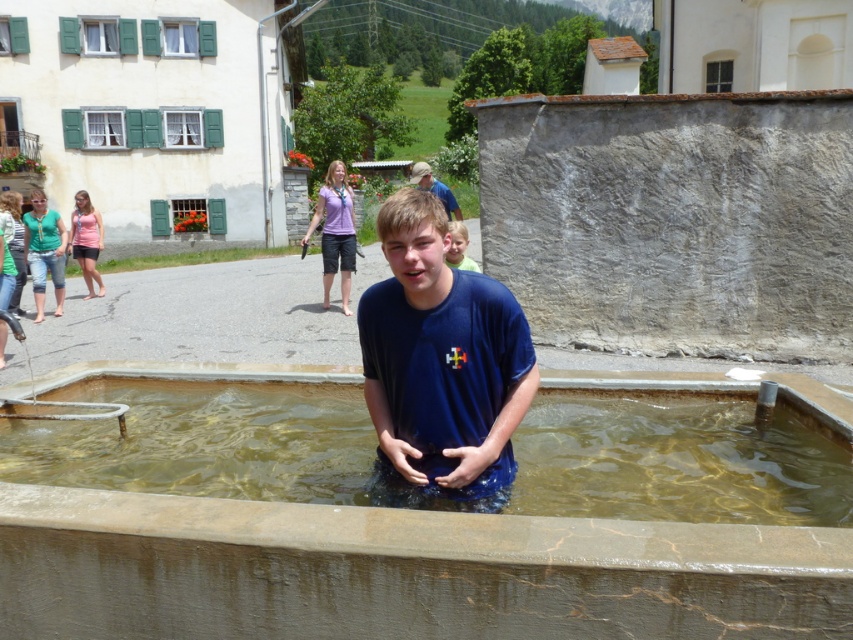
Question: Is blue matte shirt at center in front of light brown hair at upper right?

Choices:
 (A) no
 (B) yes

Answer: (B)

Question: Can you confirm if clear concrete water at center is positioned above blue matte shirt at center?

Choices:
 (A) yes
 (B) no

Answer: (B)

Question: Does clear concrete water at center appear over blue matte shirt at center?

Choices:
 (A) no
 (B) yes

Answer: (A)

Question: Which object is closer to the camera taking this photo?

Choices:
 (A) clear concrete water at center
 (B) light brown hair at upper right

Answer: (A)

Question: Which of these objects is positioned closest to the clear concrete water at center?

Choices:
 (A) light brown hair at upper right
 (B) blue matte shirt at center

Answer: (B)

Question: Which point appears closest to the camera in this image?

Choices:
 (A) (415, 209)
 (B) (461, 236)

Answer: (A)